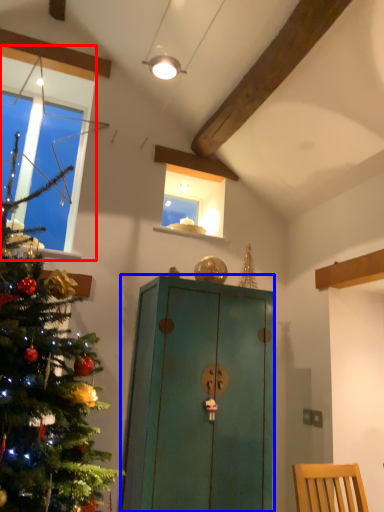
Question: Which object appears farthest to the camera in this image, window (highlighted by a red box) or cabinetry (highlighted by a blue box)?

Choices:
 (A) window
 (B) cabinetry

Answer: (A)